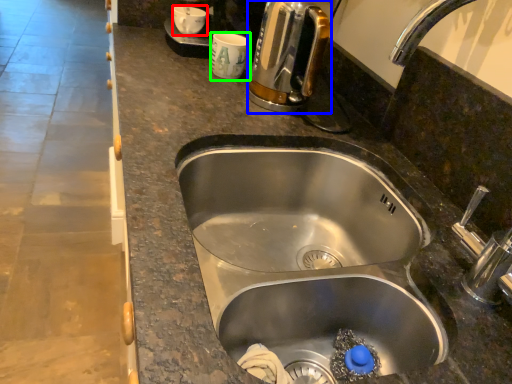
Question: Estimate the real-world distances between objects in this image. Which object is closer to coffee cup (highlighted by a red box), coffee maker (highlighted by a blue box) or coffee cup (highlighted by a green box)?

Choices:
 (A) coffee maker
 (B) coffee cup

Answer: (B)